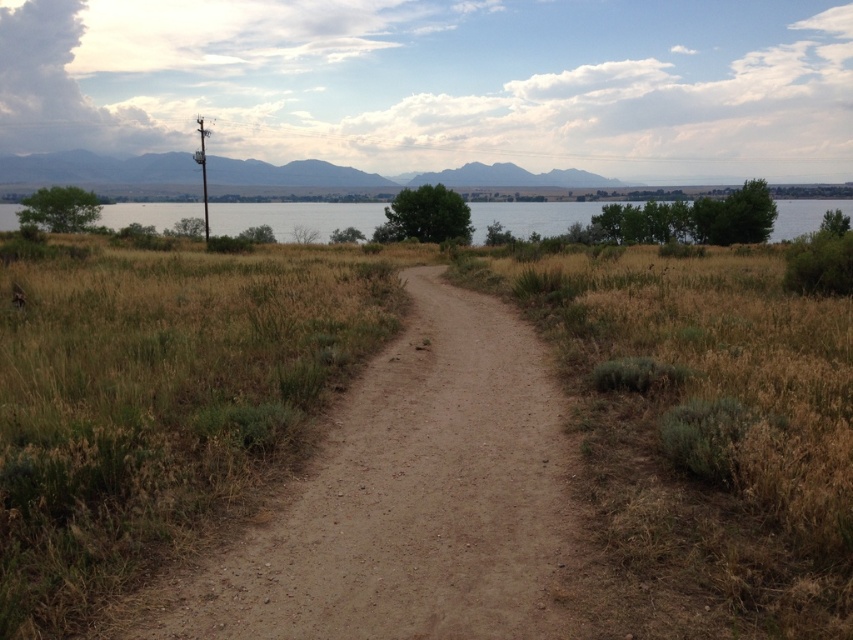
Question: Which point appears farthest from the camera in this image?

Choices:
 (A) (273, 205)
 (B) (460, 588)

Answer: (A)

Question: Which point appears closest to the camera in this image?

Choices:
 (A) (119, 625)
 (B) (7, 220)

Answer: (A)

Question: Can you confirm if dull brown dirt track at center is positioned to the left of clear water at upper center?

Choices:
 (A) yes
 (B) no

Answer: (A)

Question: Does dull brown dirt track at center appear over clear water at upper center?

Choices:
 (A) no
 (B) yes

Answer: (A)

Question: Is dull brown dirt track at center bigger than clear water at upper center?

Choices:
 (A) no
 (B) yes

Answer: (A)